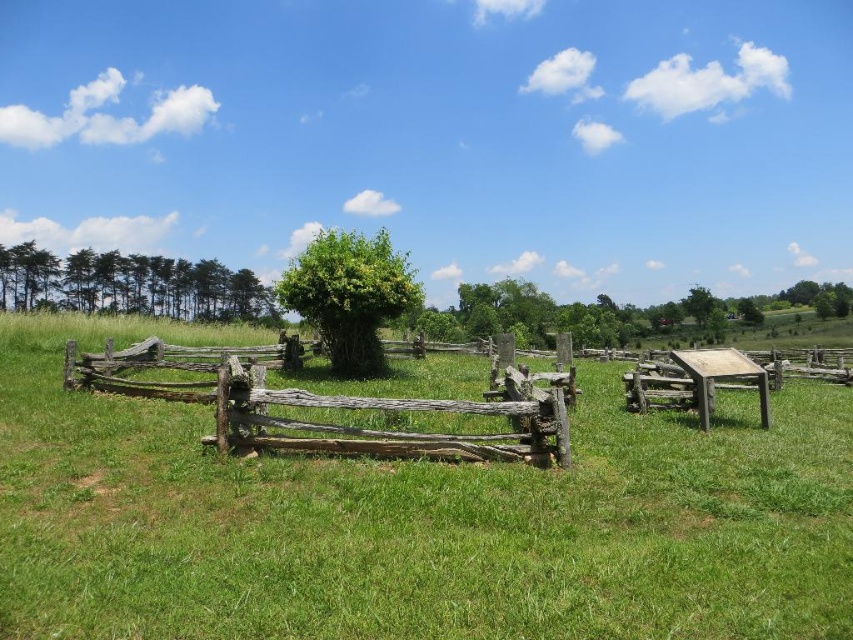
Question: Which point is closer to the camera?

Choices:
 (A) weathered wood fence at center
 (B) green matte trees at left
 (C) green leafy tree at center

Answer: (A)

Question: Is weathered wood fence at center to the right of green matte trees at left from the viewer's perspective?

Choices:
 (A) no
 (B) yes

Answer: (B)

Question: Does green matte trees at left appear under green leafy tree at center?

Choices:
 (A) yes
 (B) no

Answer: (B)

Question: Considering the relative positions of green matte trees at left and green leafy tree at center in the image provided, where is green matte trees at left located with respect to green leafy tree at center?

Choices:
 (A) below
 (B) above

Answer: (B)

Question: Among these objects, which one is nearest to the camera?

Choices:
 (A) green matte trees at left
 (B) weathered wood fence at center
 (C) green leafy tree at center

Answer: (B)

Question: Estimate the real-world distances between objects in this image. Which object is farther from the green matte trees at left?

Choices:
 (A) green leafy tree at center
 (B) weathered wood fence at center

Answer: (A)